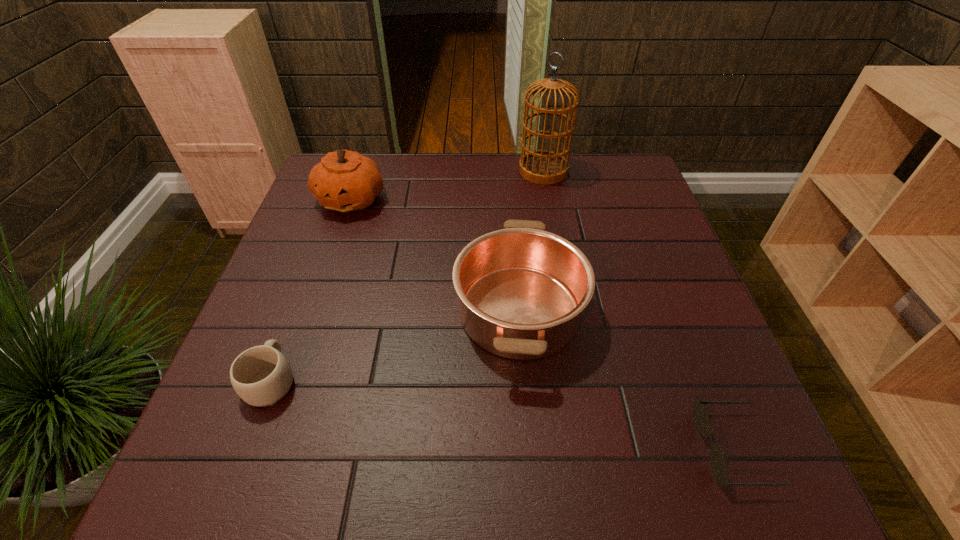
Image resolution: width=960 pixels, height=540 pixels. Identify the location of the tallest object. (541, 166).

I want to click on pumpkin, so click(x=345, y=181).

I want to click on saucepan, so click(x=522, y=290).

Where is `the fourth tallest object`? the fourth tallest object is located at coordinates point(261,376).

I want to click on the rightmost object, so click(719, 466).

Identify the location of the shortest object. The image size is (960, 540). (719, 466).

Image resolution: width=960 pixels, height=540 pixels. What are the coordinates of `vacant region located 0.280m on the left of the tallest object` in the screenshot? It's located at (428, 171).

Locate an element on the screen. The height and width of the screenshot is (540, 960). free location located 0.080m on the front-facing side of the second tallest object is located at coordinates tap(337, 241).

Find the location of `vacant space located on the back of the saucepan`. vacant space located on the back of the saucepan is located at coordinates (509, 178).

Where is `free location located on the side of the fourth tallest object with the handle`? The image size is (960, 540). free location located on the side of the fourth tallest object with the handle is located at coordinates (295, 318).